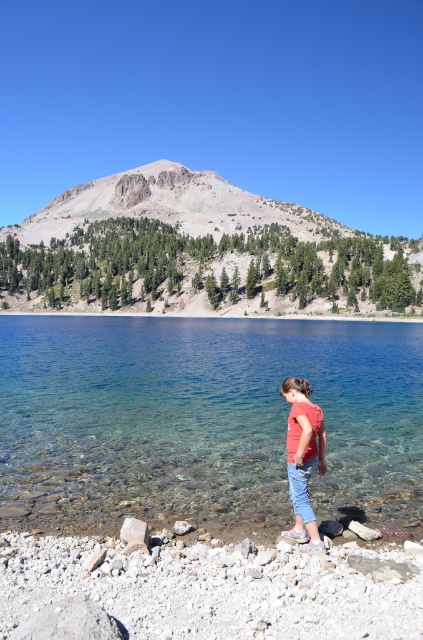
You are standing at the edge of the lake and want to walk towards the two points marked in the scene. Which point, point (x=192, y=429) or point (x=280, y=392), will you reach first?

Point (x=192, y=429) is closer to the viewer than point (x=280, y=392), so you will reach point (x=192, y=429) first.

You are a photographer aiming to capture the reflection of the red cotton shirt at center in the clear glass water at center. Can you confirm if this reflection is possible based on their positions?

The clear glass water at center is located above the red cotton shirt at center, so the reflection would not be visible since the water is above the shirt, making it impossible to see the shirt reflected in the water.

You are standing at the edge of the lake and want to reach a point that is exactly 200 feet away from you. The point you need to reach is labeled as point [420,364]. Can you determine if you can reach that point by walking straight ahead from your current position?

The distance of point [420,364] from viewer is 207.98 feet, so the point is farther away than 200 feet. Therefore, you cannot reach it by walking straight ahead from your current position as it is beyond the desired distance.